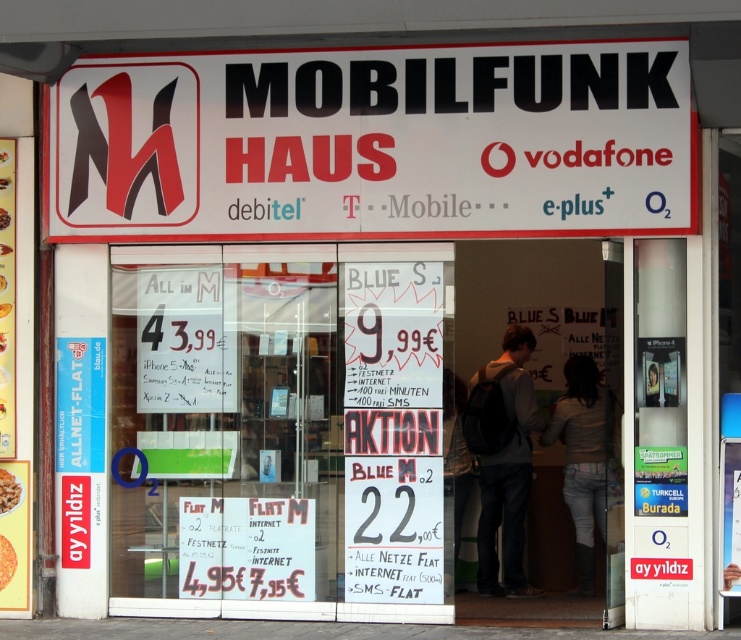
Between gray cotton hoodie at center and denim jacket at center, which one has more height?

gray cotton hoodie at center is taller.

The image size is (741, 640). I want to click on gray cotton hoodie at center, so click(x=508, y=468).

From the picture: Does white plastic sign at upper center have a larger size compared to gray cotton hoodie at center?

Yes, white plastic sign at upper center is bigger than gray cotton hoodie at center.

From the picture: Which is above, white plastic sign at upper center or gray cotton hoodie at center?

white plastic sign at upper center is above.

Based on the photo, who is more distant from viewer, (531,65) or (491,381)?

The point (491,381) is behind.

Find the location of a particular element. white plastic sign at upper center is located at coordinates (x=373, y=144).

Is point (372, 51) closer to camera compared to point (565, 452)?

Yes, it is.

Based on the photo, who is positioned more to the left, white plastic sign at upper center or denim jacket at center?

Positioned to the left is white plastic sign at upper center.

Locate an element on the screen. white plastic sign at upper center is located at coordinates (373, 144).

Locate an element on the screen. Image resolution: width=741 pixels, height=640 pixels. white plastic sign at upper center is located at coordinates (373, 144).